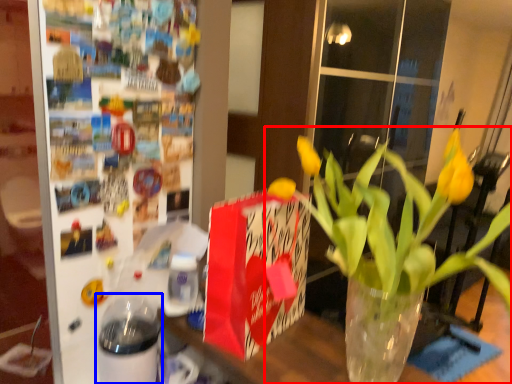
Question: Which point is further to the camera, houseplant (highlighted by a red box) or glass jar (highlighted by a blue box)?

Choices:
 (A) houseplant
 (B) glass jar

Answer: (B)